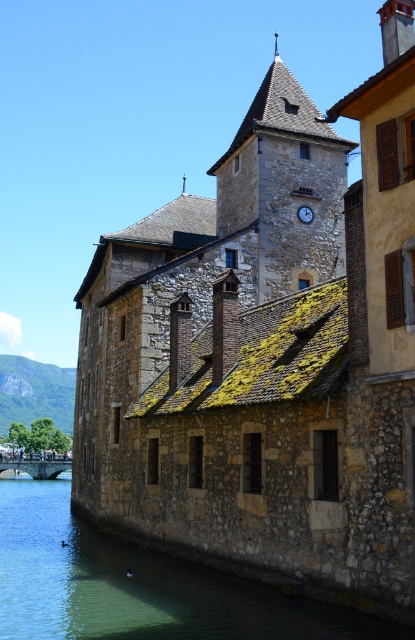
Question: Is stone clock tower at center below black metallic clock at upper center?

Choices:
 (A) no
 (B) yes

Answer: (A)

Question: Can you confirm if stone clock tower at center is positioned to the right of black metallic clock at upper center?

Choices:
 (A) no
 (B) yes

Answer: (B)

Question: Which point is farther to the camera?

Choices:
 (A) (307, 212)
 (B) (160, 604)

Answer: (A)

Question: Which point is closer to the camera taking this photo?

Choices:
 (A) (48, 497)
 (B) (310, 218)

Answer: (B)

Question: Which of these objects is positioned closest to the clear water at river lower left?

Choices:
 (A) black metallic clock at upper center
 (B) stone clock tower at center

Answer: (A)

Question: Is stone clock tower at center below black metallic clock at upper center?

Choices:
 (A) no
 (B) yes

Answer: (A)